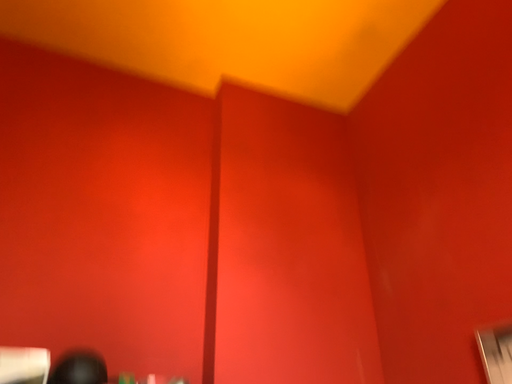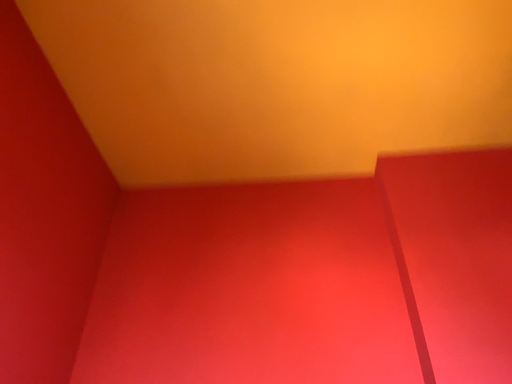
Question: Which way did the camera rotate in the video?

Choices:
 (A) rotated left
 (B) rotated right

Answer: (A)